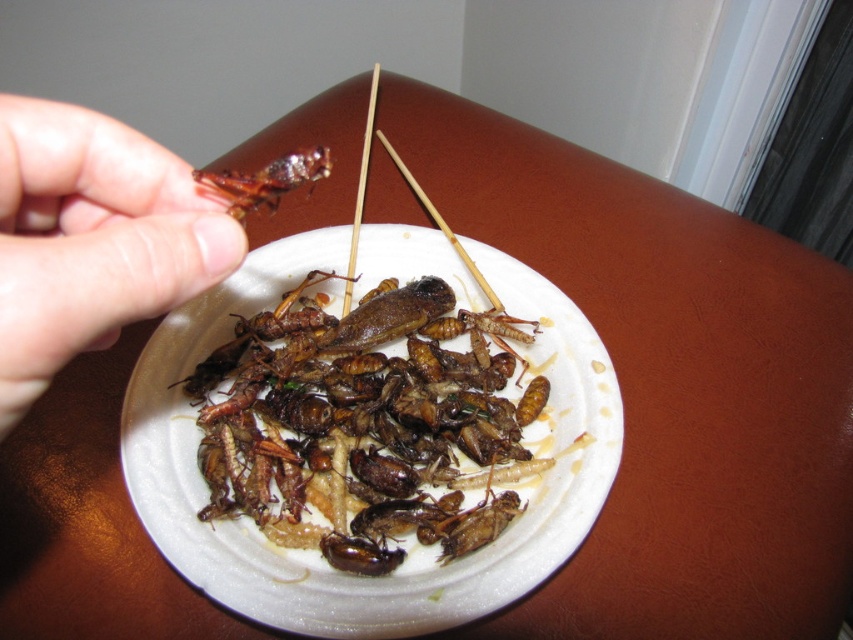
Question: Among these points, which one is farthest from the camera?

Choices:
 (A) (363, 156)
 (B) (103, 209)

Answer: (A)

Question: Which of the following is the closest to the observer?

Choices:
 (A) [x=419, y=202]
 (B) [x=364, y=173]

Answer: (B)

Question: Can you confirm if flesh-toned skin at upper left is positioned to the right of smooth wood chopstick at center?

Choices:
 (A) no
 (B) yes

Answer: (A)

Question: Which object is the farthest from the wooden chopsticks at center?

Choices:
 (A) shiny brown insect at upper left
 (B) brown crispy insects at center
 (C) smooth wood chopstick at center

Answer: (A)

Question: Can you confirm if brown crispy insects at center is bigger than smooth wood chopstick at center?

Choices:
 (A) yes
 (B) no

Answer: (A)

Question: Does brown crispy insects at center have a lesser width compared to shiny brown insect at upper left?

Choices:
 (A) no
 (B) yes

Answer: (A)